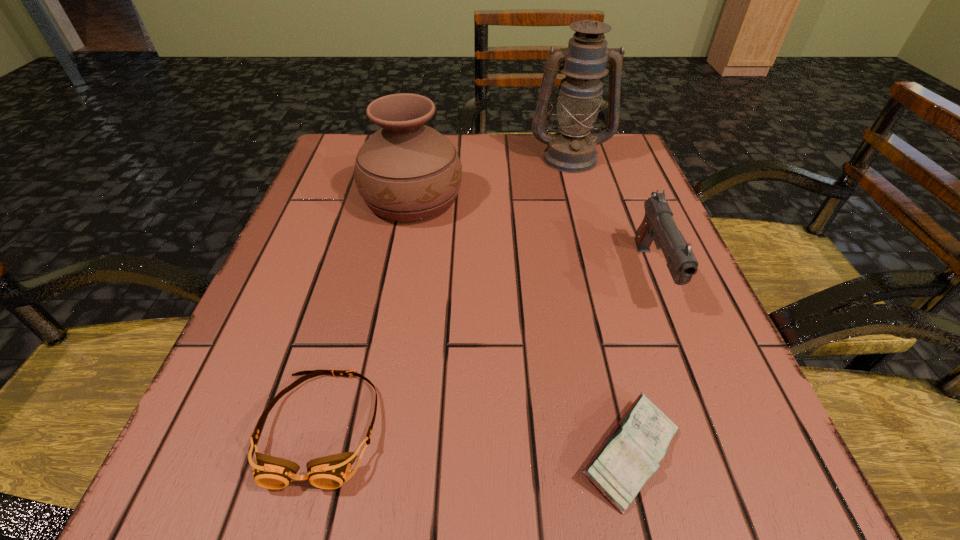
Locate an element on the screen. This screenshot has height=540, width=960. the tallest object is located at coordinates (572, 150).

Image resolution: width=960 pixels, height=540 pixels. Identify the location of the second tallest object. (407, 171).

Find the location of a particular element. This screenshot has height=540, width=960. gun is located at coordinates (658, 224).

Identify the location of the third tallest object. (658, 224).

The height and width of the screenshot is (540, 960). In order to click on goggles in this screenshot , I will do `click(330, 472)`.

Locate an element on the screen. This screenshot has height=540, width=960. diary is located at coordinates (630, 455).

The image size is (960, 540). What are the coordinates of `free location located on the left of the oil lamp` in the screenshot? It's located at (385, 157).

At what (x,y) coordinates should I click in order to perform the action: click on free point located 0.180m on the back of the second tallest object. Please return your answer as a coordinate pair (x, y). Looking at the image, I should click on (424, 134).

This screenshot has height=540, width=960. I want to click on vacant position located in the direction the third farthest object is aimed, so click(x=700, y=393).

Identify the location of vacant area situated 0.300m on the left of the diary. (338, 454).